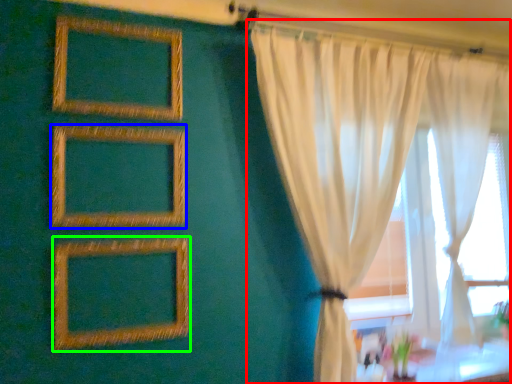
Question: Which object is positioned closest to curtain (highlighted by a red box)? Select from picture frame (highlighted by a blue box) and picture frame (highlighted by a green box).

Choices:
 (A) picture frame
 (B) picture frame

Answer: (A)